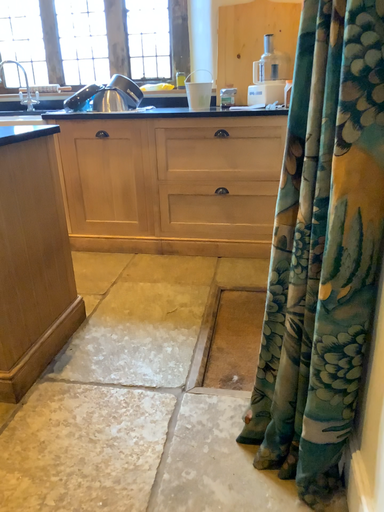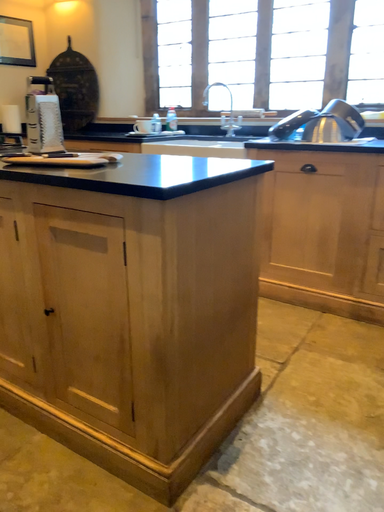
Question: Which way did the camera rotate in the video?

Choices:
 (A) rotated left
 (B) rotated right

Answer: (A)